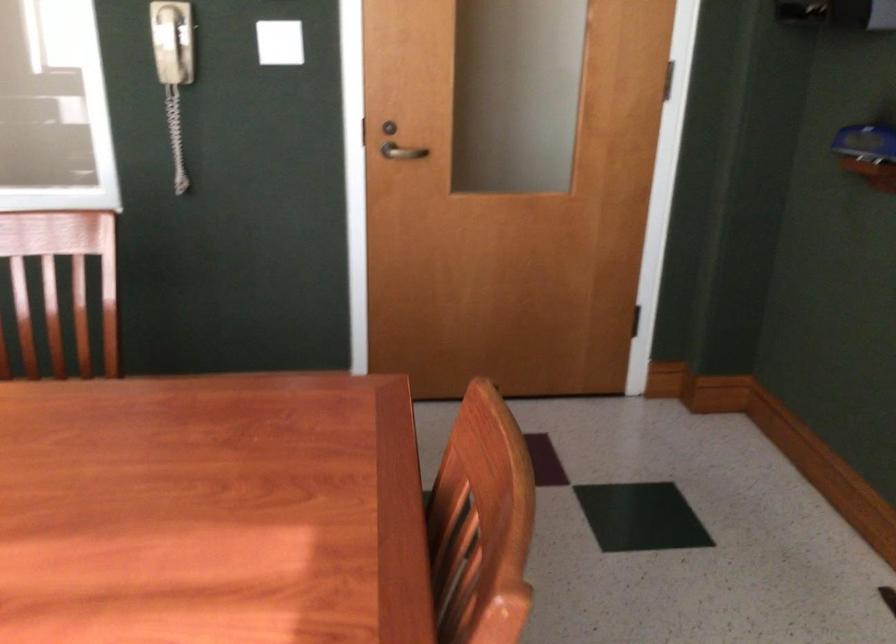
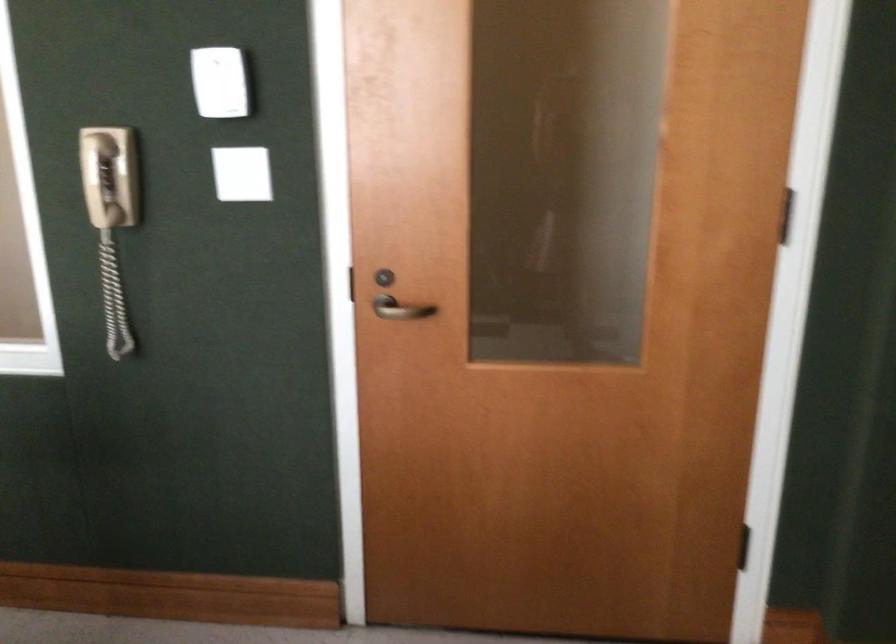
The point at [358,129] is marked in the first image. Where is the corresponding point in the second image?

(346, 283)